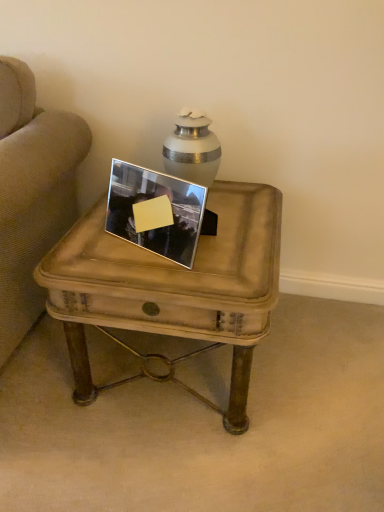
Question: Based on their positions, is distressed wood coffee table at center located to the left or right of silver metallic picture frame at center?

Choices:
 (A) right
 (B) left

Answer: (A)

Question: Is distressed wood coffee table at center spatially inside silver metallic picture frame at center, or outside of it?

Choices:
 (A) inside
 (B) outside

Answer: (B)

Question: From a real-world perspective, is distressed wood coffee table at center positioned above or below silver metallic picture frame at center?

Choices:
 (A) above
 (B) below

Answer: (B)

Question: In the image, is silver metallic picture frame at center on the left side or the right side of distressed wood coffee table at center?

Choices:
 (A) left
 (B) right

Answer: (A)

Question: Looking at their shapes, would you say silver metallic picture frame at center is wider or thinner than distressed wood coffee table at center?

Choices:
 (A) wide
 (B) thin

Answer: (B)

Question: Is silver metallic picture frame at center taller or shorter than distressed wood coffee table at center?

Choices:
 (A) tall
 (B) short

Answer: (B)

Question: Considering the positions of silver metallic picture frame at center and distressed wood coffee table at center in the image, is silver metallic picture frame at center bigger or smaller than distressed wood coffee table at center?

Choices:
 (A) big
 (B) small

Answer: (B)